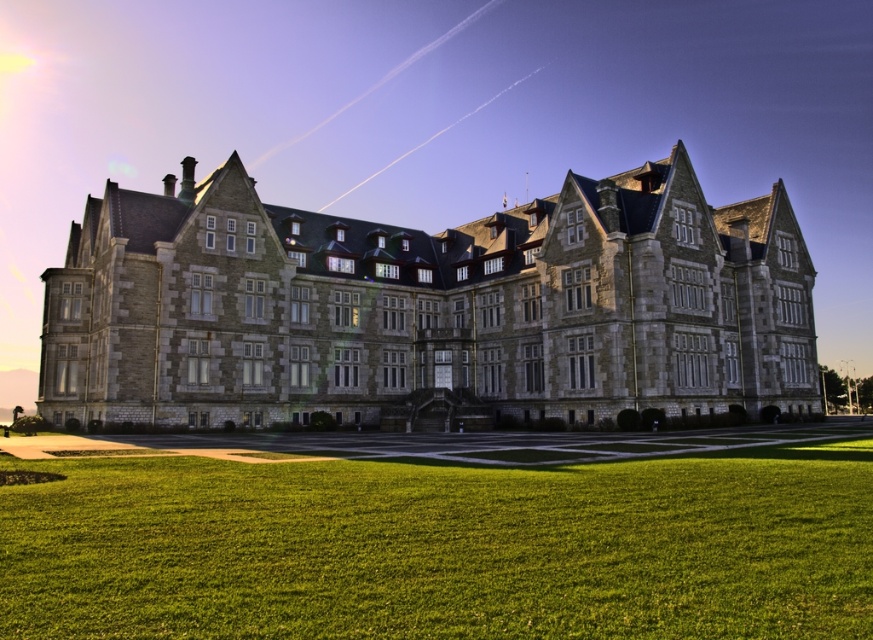
Which is below, stone mansion at center or green grass at lower center?

Positioned lower is green grass at lower center.

Is stone mansion at center smaller than green grass at lower center?

Actually, stone mansion at center might be larger than green grass at lower center.

Does point (244, 342) lie behind point (792, 573)?

Yes, it is.

The height and width of the screenshot is (640, 873). In order to click on stone mansion at center in this screenshot , I will do `click(428, 305)`.